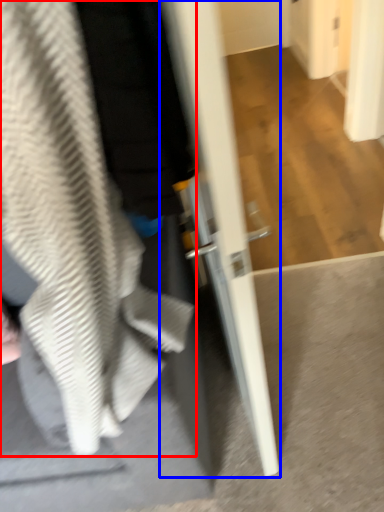
Question: Which point is closer to the camera, sweatshirt (highlighted by a red box) or door (highlighted by a blue box)?

Choices:
 (A) sweatshirt
 (B) door

Answer: (B)